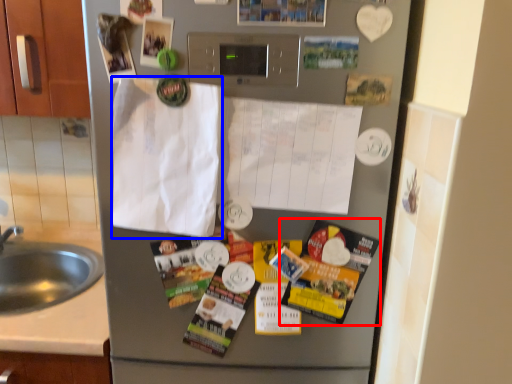
Question: Which object is closer to the camera taking this photo, flyer (highlighted by a red box) or envelope (highlighted by a blue box)?

Choices:
 (A) flyer
 (B) envelope

Answer: (B)